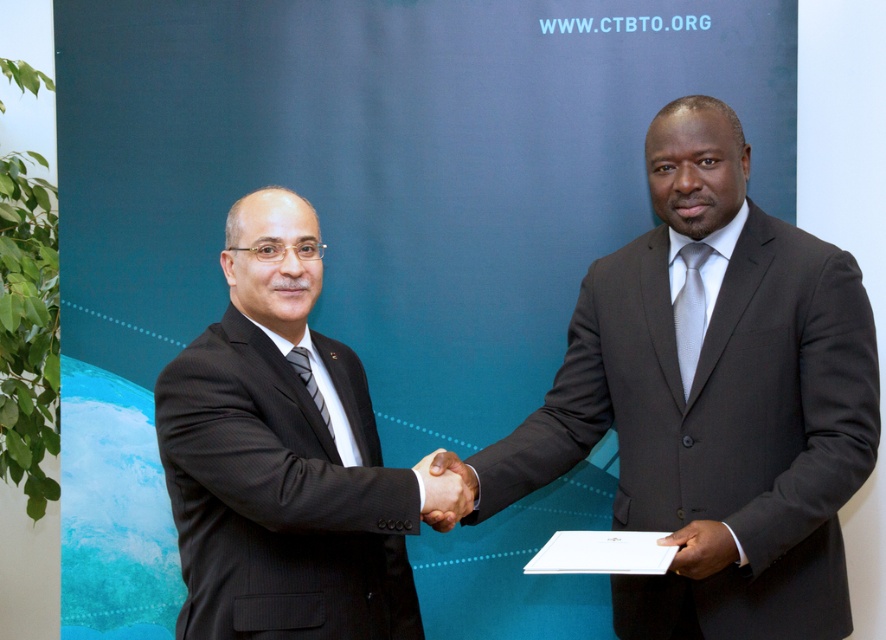
You are an event planner observing a professional meeting scene. You notice the black suit at center and the black matte hand at center. Which object is positioned higher in the image?

The black suit at center is positioned higher than the black matte hand at center according to the description.

You are a photographer standing 5 feet away from the two men in the image. You need to capture a photo where both the dark gray suit at center and the black suit at center are in focus. Given that your camera has a depth of field that can sharply focus on objects within a 20 inch range, will both suits be in focus?

The dark gray suit at center and black suit at center are 21.13 inches apart. Since the distance between them exceeds the camera sensor depth of field range of 20 inches, the two suits cannot both be in focus simultaneously.